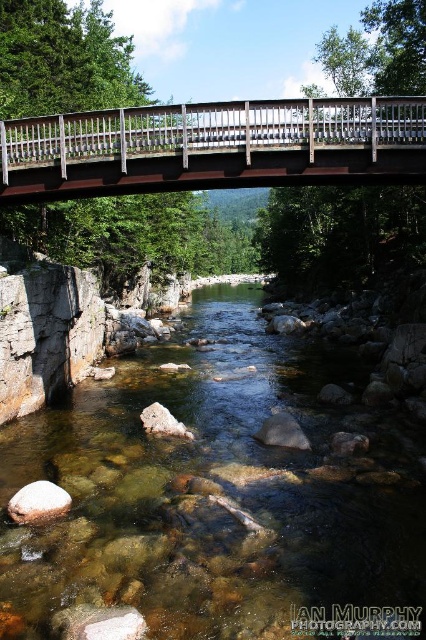
Question: Which of the following is the farthest from the observer?

Choices:
 (A) brown wooden bridge at center
 (B) white smooth rock at lower left
 (C) clear stone stream at center

Answer: (A)

Question: Among these objects, which one is nearest to the camera?

Choices:
 (A) brown wooden bridge at center
 (B) clear stone stream at center
 (C) white smooth rock at lower left

Answer: (B)

Question: From the image, what is the correct spatial relationship of clear stone stream at center in relation to brown wooden bridge at center?

Choices:
 (A) left
 (B) right

Answer: (B)

Question: Which of the following is the closest to the observer?

Choices:
 (A) clear stone stream at center
 (B) brown wooden bridge at center
 (C) white smooth rock at lower left

Answer: (A)

Question: Can you confirm if clear stone stream at center is smaller than brown wooden bridge at center?

Choices:
 (A) no
 (B) yes

Answer: (A)

Question: Does brown wooden bridge at center appear on the right side of white smooth rock at lower left?

Choices:
 (A) yes
 (B) no

Answer: (A)